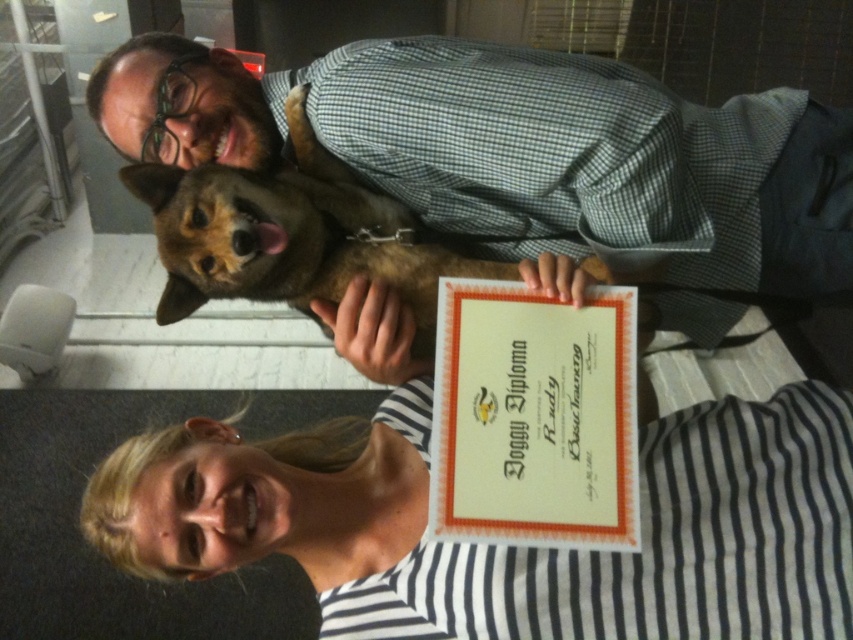
Does point (489, 412) lie behind point (300, 282)?

No, (489, 412) is in front of (300, 282).

Does orange paper doggy diploma at center appear on the left side of brown furry dog at upper center?

In fact, orange paper doggy diploma at center is to the right of brown furry dog at upper center.

Identify the location of orange paper doggy diploma at center. (534, 417).